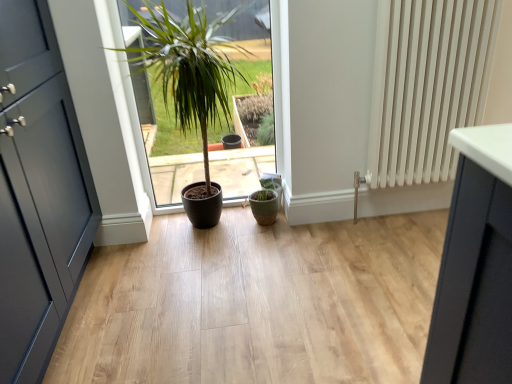
Question: Is matte brown pot at center in front of white ribbed radiator at right?

Choices:
 (A) no
 (B) yes

Answer: (B)

Question: Is matte brown pot at center not near white ribbed radiator at right?

Choices:
 (A) no
 (B) yes

Answer: (A)

Question: Is matte brown pot at center at the left side of white ribbed radiator at right?

Choices:
 (A) yes
 (B) no

Answer: (A)

Question: From a real-world perspective, is matte brown pot at center located beneath white ribbed radiator at right?

Choices:
 (A) yes
 (B) no

Answer: (A)

Question: From the image's perspective, would you say matte brown pot at center is positioned over white ribbed radiator at right?

Choices:
 (A) yes
 (B) no

Answer: (B)

Question: In the image, is matte brown pot at center positioned in front of or behind matte green flowerpot at center?

Choices:
 (A) front
 (B) behind

Answer: (A)

Question: In terms of height, does matte brown pot at center look taller or shorter compared to matte green flowerpot at center?

Choices:
 (A) short
 (B) tall

Answer: (B)

Question: Considering the positions of matte brown pot at center and matte green flowerpot at center in the image, is matte brown pot at center bigger or smaller than matte green flowerpot at center?

Choices:
 (A) small
 (B) big

Answer: (B)

Question: Looking at their shapes, would you say matte brown pot at center is wider or thinner than matte green flowerpot at center?

Choices:
 (A) wide
 (B) thin

Answer: (A)

Question: Considering the positions of matte dark blue door at left and matte brown pot at center in the image, is matte dark blue door at left wider or thinner than matte brown pot at center?

Choices:
 (A) thin
 (B) wide

Answer: (B)

Question: Does point (38, 309) appear closer or farther from the camera than point (214, 48)?

Choices:
 (A) farther
 (B) closer

Answer: (B)

Question: Based on their sizes in the image, would you say matte dark blue door at left is bigger or smaller than matte brown pot at center?

Choices:
 (A) small
 (B) big

Answer: (B)

Question: In the image, is matte dark blue door at left positioned in front of or behind matte brown pot at center?

Choices:
 (A) behind
 (B) front

Answer: (B)

Question: In terms of width, does matte brown pot at center look wider or thinner when compared to matte dark blue door at left?

Choices:
 (A) thin
 (B) wide

Answer: (A)

Question: From a real-world perspective, is matte brown pot at center physically located above or below matte dark blue door at left?

Choices:
 (A) below
 (B) above

Answer: (A)